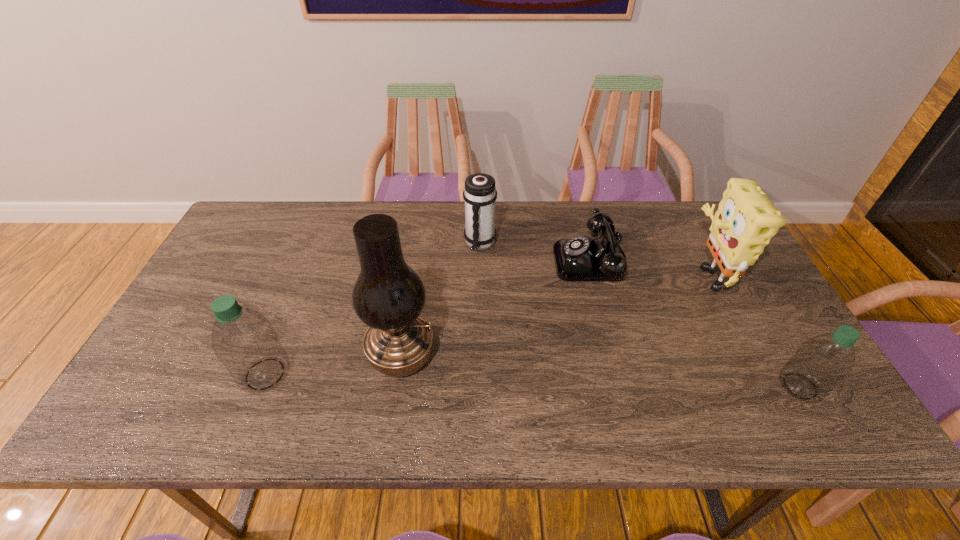
Where is `vacant space in between the shorter water bottle and the fourth object from right to left`? vacant space in between the shorter water bottle and the fourth object from right to left is located at coordinates (640, 315).

Locate an element on the screen. The width and height of the screenshot is (960, 540). vacant region between the right water bottle and the telephone is located at coordinates (696, 323).

Identify which object is the third closest to the thermos bottle. Please provide its 2D coordinates. Your answer should be formatted as a tuple, i.e. [(x, y)], where the tuple contains the x and y coordinates of a point satisfying the conditions above.

[(243, 340)]

Image resolution: width=960 pixels, height=540 pixels. I want to click on object that stands as the fourth closest to the third object from left to right, so click(x=746, y=220).

This screenshot has width=960, height=540. I want to click on blank space that satisfies the following two spatial constraints: 1. on the dial of the telephone; 2. on the front side of the fifth object from right to left, so click(616, 356).

Find the location of a particular element. free space that satisfies the following two spatial constraints: 1. on the dial of the shortest object; 2. on the right side of the right water bottle is located at coordinates (624, 386).

At what (x,y) coordinates should I click in order to perform the action: click on free spot that satisfies the following two spatial constraints: 1. on the face of the shorter water bottle; 2. on the left side of the sponge. Please return your answer as a coordinate pair (x, y). The height and width of the screenshot is (540, 960). Looking at the image, I should click on (763, 386).

The image size is (960, 540). I want to click on vacant space that satisfies the following two spatial constraints: 1. on the face of the sponge; 2. on the front side of the tallest object, so pos(747,356).

I want to click on free location that satisfies the following two spatial constraints: 1. on the face of the sponge; 2. on the front side of the fifth object from right to left, so click(x=747, y=356).

This screenshot has height=540, width=960. In order to click on vacant area in the image that satisfies the following two spatial constraints: 1. on the back side of the oil lamp; 2. on the right side of the taller water bottle in this screenshot , I will do `click(273, 356)`.